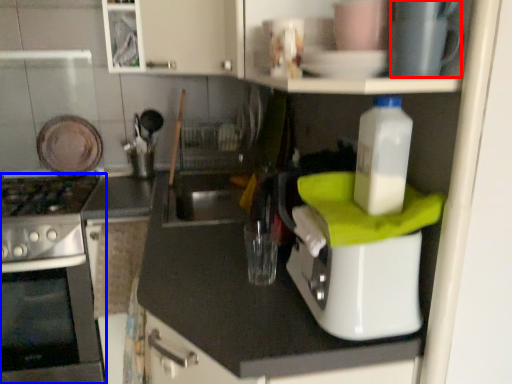
Question: Which object appears farthest to the camera in this image, appliance (highlighted by a red box) or home appliance (highlighted by a blue box)?

Choices:
 (A) appliance
 (B) home appliance

Answer: (B)